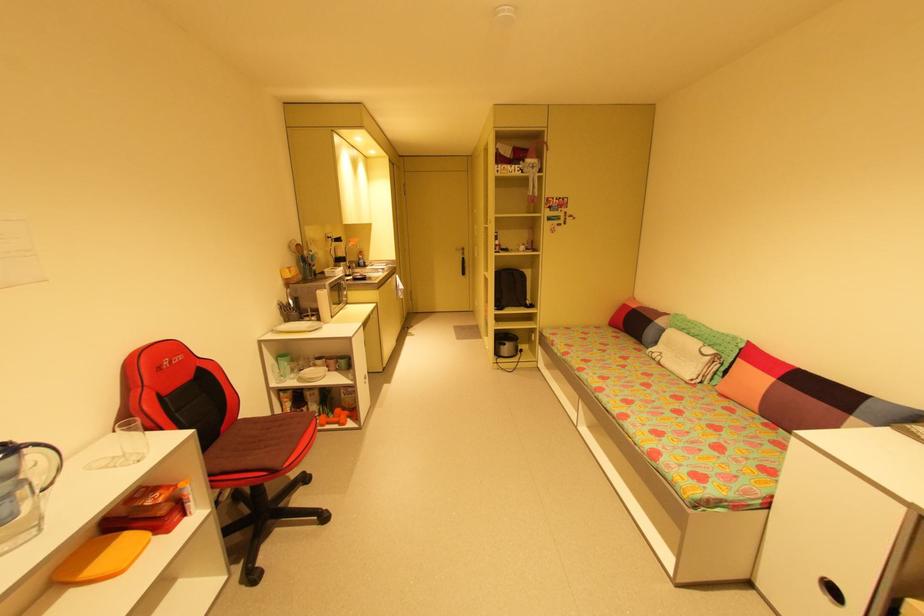
What are the coordinates of `kitchen cabinet handle` in the screenshot? It's located at (533, 273).